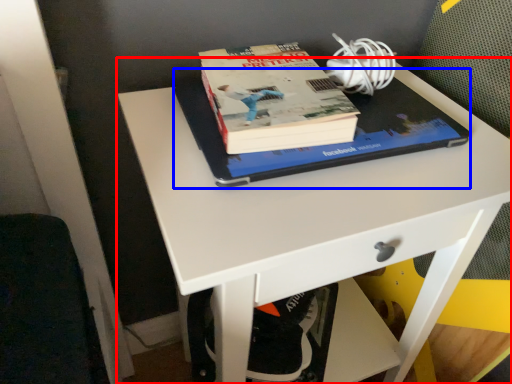
Question: Which of the following is the farthest to the observer, desk (highlighted by a red box) or notebook (highlighted by a blue box)?

Choices:
 (A) desk
 (B) notebook

Answer: (B)